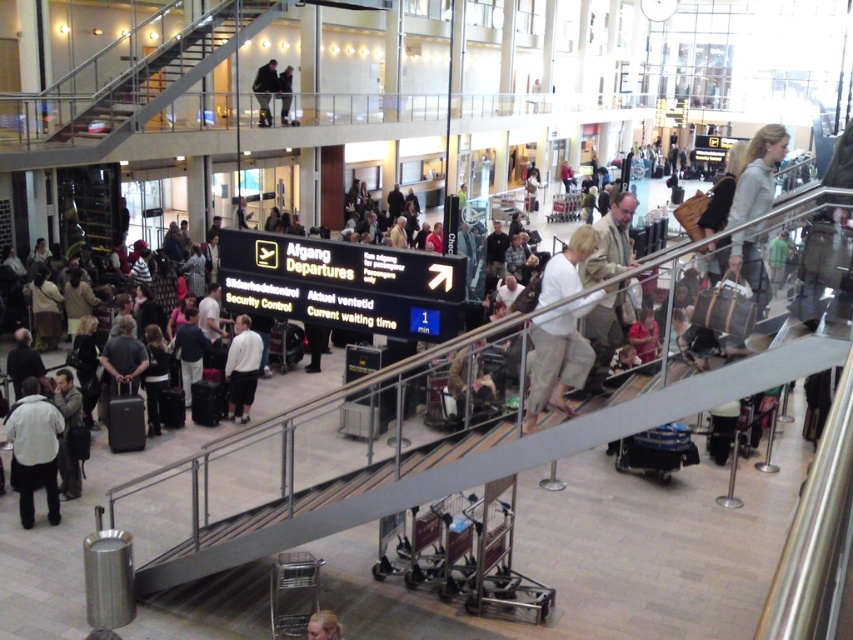
Can you confirm if white matte shirt at center is positioned to the left of dark gray suit at upper center?

In fact, white matte shirt at center is to the right of dark gray suit at upper center.

Is white matte shirt at center closer to camera compared to dark gray suit at upper center?

Yes, white matte shirt at center is in front of dark gray suit at upper center.

Is point (231, 413) positioned in front of point (282, 92)?

Yes, point (231, 413) is in front of point (282, 92).

Locate an element on the screen. This screenshot has height=640, width=853. white matte shirt at center is located at coordinates click(x=242, y=369).

Which is below, dark blue jeans at upper center or dark gray suit at upper center?

dark gray suit at upper center

Is dark blue jeans at upper center below dark gray suit at upper center?

Actually, dark blue jeans at upper center is above dark gray suit at upper center.

Which is behind, point (263, 109) or point (277, 90)?

Point (277, 90)

I want to click on dark blue jeans at upper center, so tap(265, 90).

Does light gray sweater at upper right have a smaller size compared to dark blue jeans at upper center?

No.

Does light gray sweater at upper right have a greater width compared to dark blue jeans at upper center?

Yes.

Find the location of `light gray sweater at upper right`. light gray sweater at upper right is located at coordinates (757, 173).